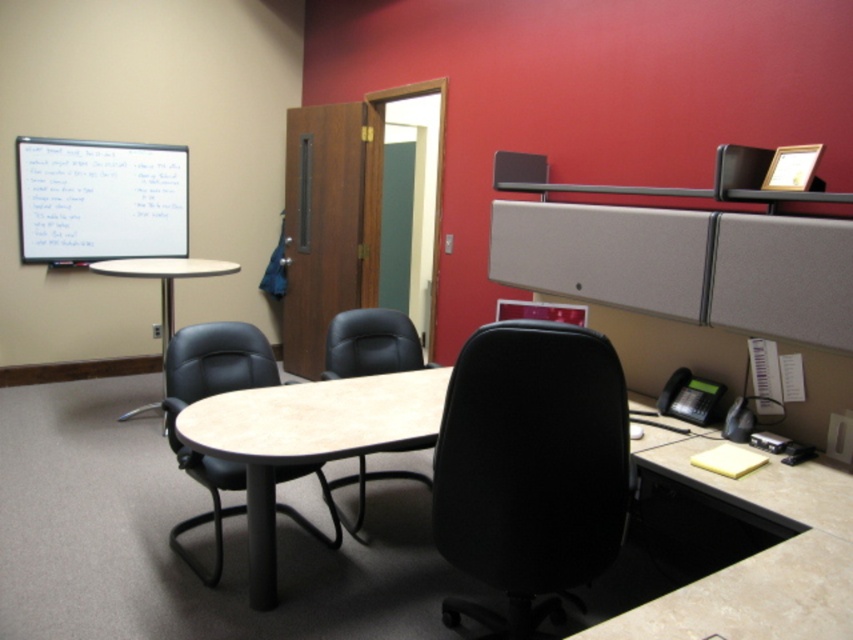
The image size is (853, 640). What do you see at coordinates (206, 396) in the screenshot?
I see `black leather swivel chair at center` at bounding box center [206, 396].

Does point (202, 481) come in front of point (183, 257)?

Yes, it is in front of point (183, 257).

Does point (165, 408) lie behind point (160, 273)?

No, it is not.

This screenshot has width=853, height=640. Find the location of `black leather swivel chair at center`. black leather swivel chair at center is located at coordinates (206, 396).

Which is behind, point (157, 269) or point (506, 317)?

Positioned behind is point (157, 269).

Does metallic silver table at center have a lesser height compared to matte black monitor at upper center?

In fact, metallic silver table at center may be taller than matte black monitor at upper center.

Is point (194, 259) closer to camera compared to point (523, 317)?

No, (194, 259) is behind (523, 317).

I want to click on metallic silver table at center, so click(x=164, y=280).

From the picture: Can you confirm if white matte projection screen at upper left is taller than matte black monitor at upper center?

Indeed, white matte projection screen at upper left has a greater height compared to matte black monitor at upper center.

Is white matte projection screen at upper left positioned behind matte black monitor at upper center?

Yes.

Who is more distant from viewer, (107, 163) or (572, 314)?

The point (107, 163) is behind.

The width and height of the screenshot is (853, 640). Identify the location of white matte projection screen at upper left. (100, 200).